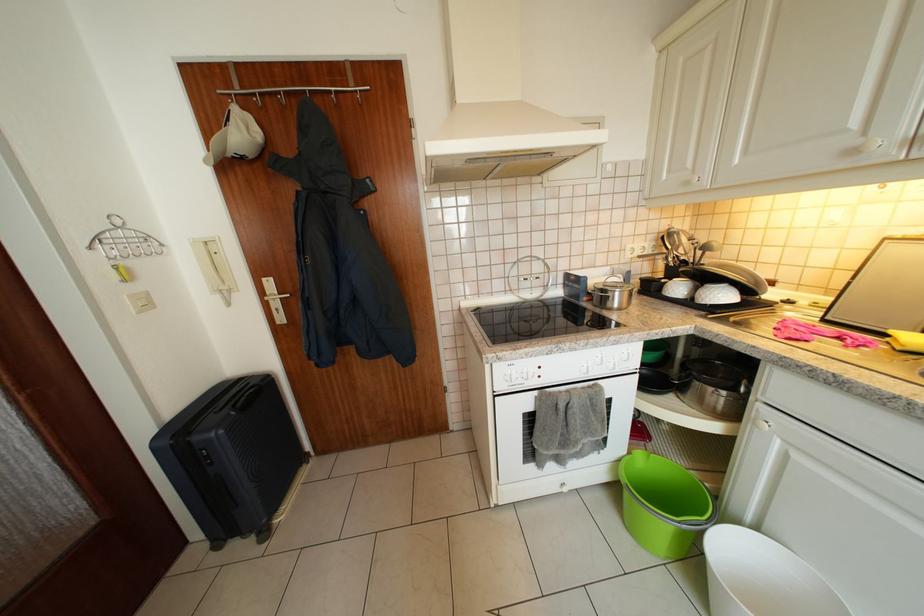
The width and height of the screenshot is (924, 616). What do you see at coordinates (613, 292) in the screenshot? I see `the glass pot lid handle` at bounding box center [613, 292].